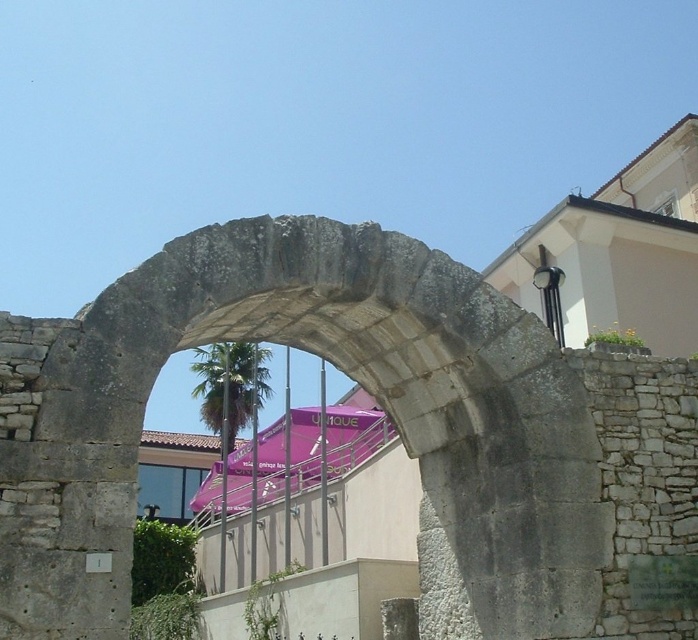
Question: Can you confirm if gray stone archway at center is positioned above green leafy palm tree at center?

Choices:
 (A) yes
 (B) no

Answer: (A)

Question: Does gray stone archway at center appear over green leafy palm tree at center?

Choices:
 (A) no
 (B) yes

Answer: (B)

Question: Which point is closer to the camera?

Choices:
 (A) gray stone archway at center
 (B) green leafy palm tree at center

Answer: (A)

Question: Which point appears farthest from the camera in this image?

Choices:
 (A) (244, 400)
 (B) (73, 362)

Answer: (A)

Question: Does gray stone archway at center appear under green leafy palm tree at center?

Choices:
 (A) yes
 (B) no

Answer: (B)